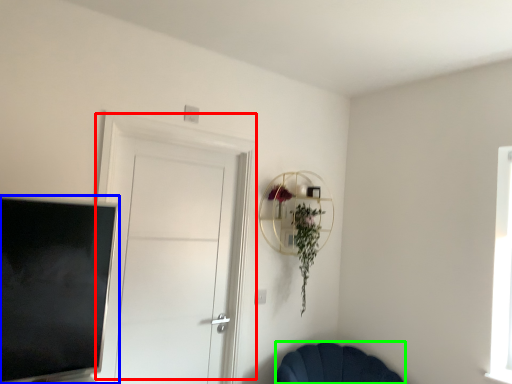
Question: Estimate the real-world distances between objects in this image. Which object is farther from door (highlighted by a red box), television (highlighted by a blue box) or chair (highlighted by a green box)?

Choices:
 (A) television
 (B) chair

Answer: (B)